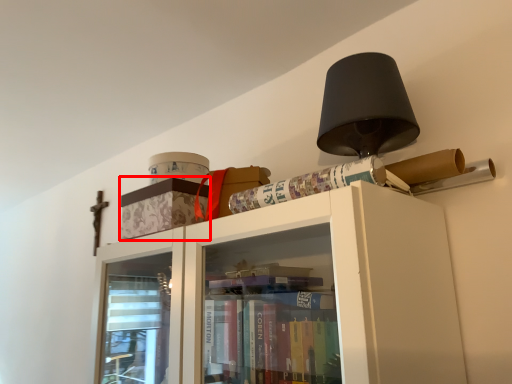
Question: From the image's perspective, what is the correct spatial positioning of cabinetry (annotated by the red box) in reference to paperback book?

Choices:
 (A) below
 (B) above

Answer: (A)